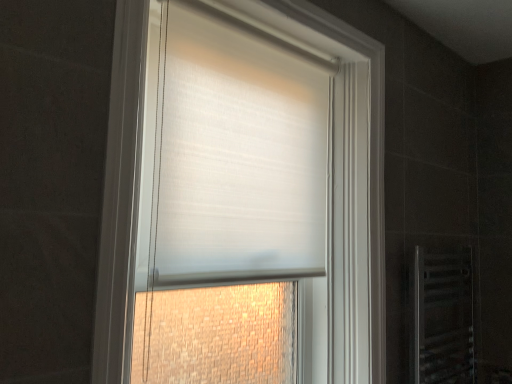
What do you see at coordinates (237, 153) in the screenshot?
I see `white sheer blind at center` at bounding box center [237, 153].

I want to click on white sheer blind at center, so click(x=237, y=153).

Image resolution: width=512 pixels, height=384 pixels. What are the coordinates of `clear plastic screen door at lower right` in the screenshot? It's located at (442, 317).

Could you tell me if clear plastic screen door at lower right is facing white matte roller blind at center?

No, clear plastic screen door at lower right is not facing towards white matte roller blind at center.

From a real-world perspective, is clear plastic screen door at lower right located higher than white matte roller blind at center?

Actually, clear plastic screen door at lower right is physically below white matte roller blind at center in the real world.

In the image, is clear plastic screen door at lower right positioned in front of or behind white matte roller blind at center?

In the image, clear plastic screen door at lower right appears behind white matte roller blind at center.

Can you confirm if clear plastic screen door at lower right is smaller than white matte roller blind at center?

Correct, clear plastic screen door at lower right occupies less space than white matte roller blind at center.

Locate an element on the screen. screen door that appears below the white sheer blind at center (from a real-world perspective) is located at coordinates (442, 317).

Which is farther, (417, 382) or (327, 61)?

The point (417, 382) is farther from the camera.

Would you say clear plastic screen door at lower right is to the left or to the right of white sheer blind at center in the picture?

clear plastic screen door at lower right is positioned on white sheer blind at center's right side.

Which of these two, clear plastic screen door at lower right or white sheer blind at center, is wider?

With larger width is white sheer blind at center.

Is the position of white matte roller blind at center more distant than that of clear plastic screen door at lower right?

No, white matte roller blind at center is closer to the viewer.

Is white matte roller blind at center located outside clear plastic screen door at lower right?

Absolutely, white matte roller blind at center is external to clear plastic screen door at lower right.

Is the surface of white matte roller blind at center in direct contact with clear plastic screen door at lower right?

white matte roller blind at center is not next to clear plastic screen door at lower right, and they're not touching.

Which is in front, point (178, 200) or point (412, 342)?

The point (178, 200) is closer.

Considering the positions of objects white sheer blind at center and clear plastic screen door at lower right in the image provided, who is more to the right, white sheer blind at center or clear plastic screen door at lower right?

clear plastic screen door at lower right.

Between white sheer blind at center and clear plastic screen door at lower right, which one has less height?

clear plastic screen door at lower right.

Is white sheer blind at center thinner than clear plastic screen door at lower right?

No, white sheer blind at center is not thinner than clear plastic screen door at lower right.

In the scene shown: Can you confirm if white sheer blind at center is positioned to the left of white matte roller blind at center?

Correct, you'll find white sheer blind at center to the left of white matte roller blind at center.

Considering the sizes of objects white sheer blind at center and white matte roller blind at center in the image provided, who is smaller, white sheer blind at center or white matte roller blind at center?

Smaller between the two is white sheer blind at center.

The width and height of the screenshot is (512, 384). Find the location of `blind that is behind the white matte roller blind at center`. blind that is behind the white matte roller blind at center is located at coordinates (237, 153).

Can white matte roller blind at center be found inside white sheer blind at center?

That's incorrect, white matte roller blind at center is not inside white sheer blind at center.

Looking at this image, what's the angular difference between white matte roller blind at center and white sheer blind at center's facing directions?

The angular difference between white matte roller blind at center and white sheer blind at center is 0.000168 degrees.

Is point (132, 84) positioned before point (327, 175)?

Yes, point (132, 84) is closer to viewer.

Looking at this image, how far apart are white matte roller blind at center and white sheer blind at center?

white matte roller blind at center and white sheer blind at center are 10.89 inches apart from each other.

Is white matte roller blind at center taller than white sheer blind at center?

Yes, white matte roller blind at center is taller than white sheer blind at center.

Find the location of a particular element. The height and width of the screenshot is (384, 512). screen door located behind the white matte roller blind at center is located at coordinates (442, 317).

Identify the location of blind in front of the clear plastic screen door at lower right. Image resolution: width=512 pixels, height=384 pixels. (237, 153).

Based on their spatial positions, is clear plastic screen door at lower right or white matte roller blind at center further from white sheer blind at center?

clear plastic screen door at lower right is positioned further to the anchor white sheer blind at center.

Estimate the real-world distances between objects in this image. Which object is further from clear plastic screen door at lower right, white sheer blind at center or white matte roller blind at center?

white sheer blind at center.

When comparing their distances from white matte roller blind at center, does white sheer blind at center or clear plastic screen door at lower right seem further?

clear plastic screen door at lower right.

In the scene shown: Based on their spatial positions, is white matte roller blind at center or white sheer blind at center further from clear plastic screen door at lower right?

white sheer blind at center lies further to clear plastic screen door at lower right than the other object.

Based on their spatial positions, is clear plastic screen door at lower right or white sheer blind at center further from white matte roller blind at center?

Based on the image, clear plastic screen door at lower right appears to be further to white matte roller blind at center.

When comparing their distances from white sheer blind at center, does white matte roller blind at center or clear plastic screen door at lower right seem closer?

white matte roller blind at center is closer to white sheer blind at center.

The width and height of the screenshot is (512, 384). I want to click on window between white sheer blind at center and clear plastic screen door at lower right, so click(x=121, y=196).